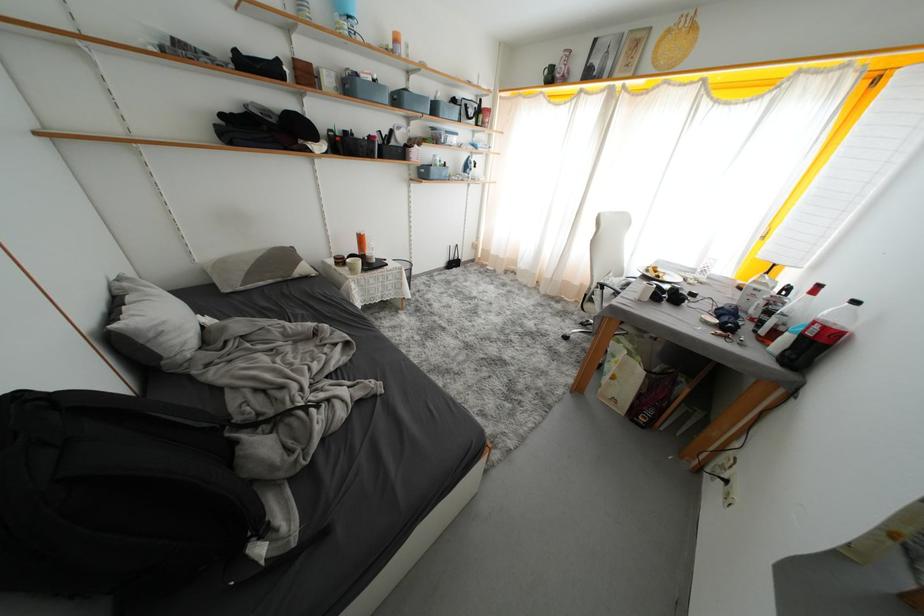
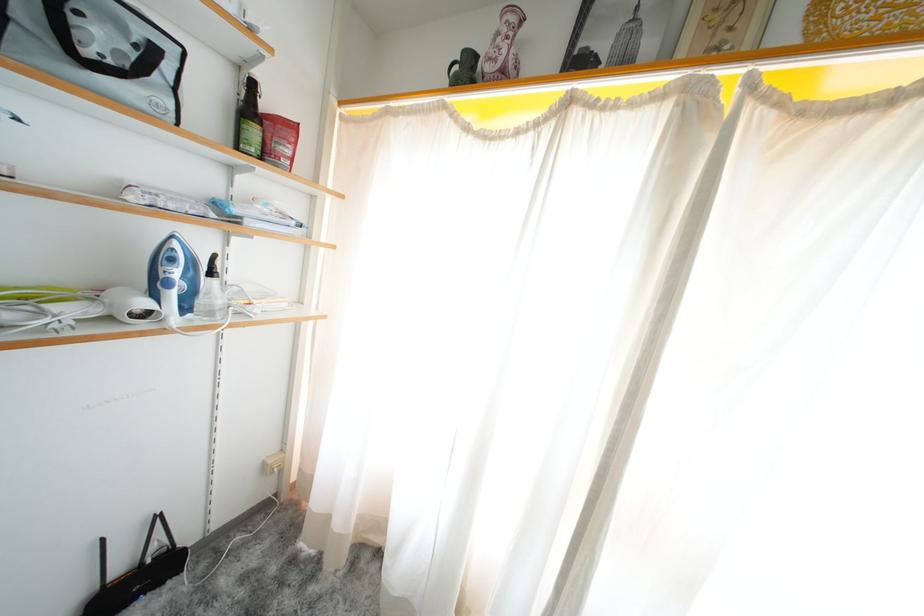
Where in the second image is the point corresponding to point (568, 59) from the first image?

(504, 28)